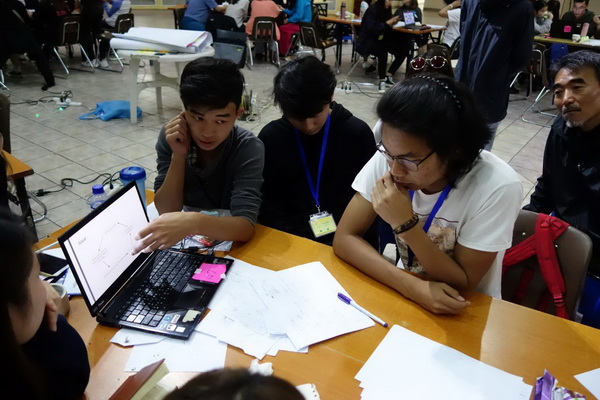
Where is `cord`? Image resolution: width=600 pixels, height=400 pixels. cord is located at coordinates (115, 173), (73, 181), (69, 85), (40, 97), (362, 85), (345, 86), (334, 87).